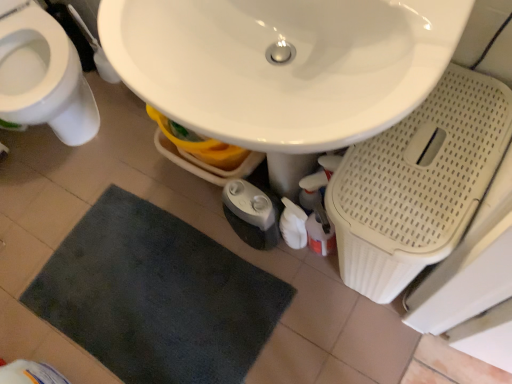
Find the location of a particular element. The image size is (512, 384). free space below dark gray plush bath mat at lower center (from a real-world perspective) is located at coordinates (183, 294).